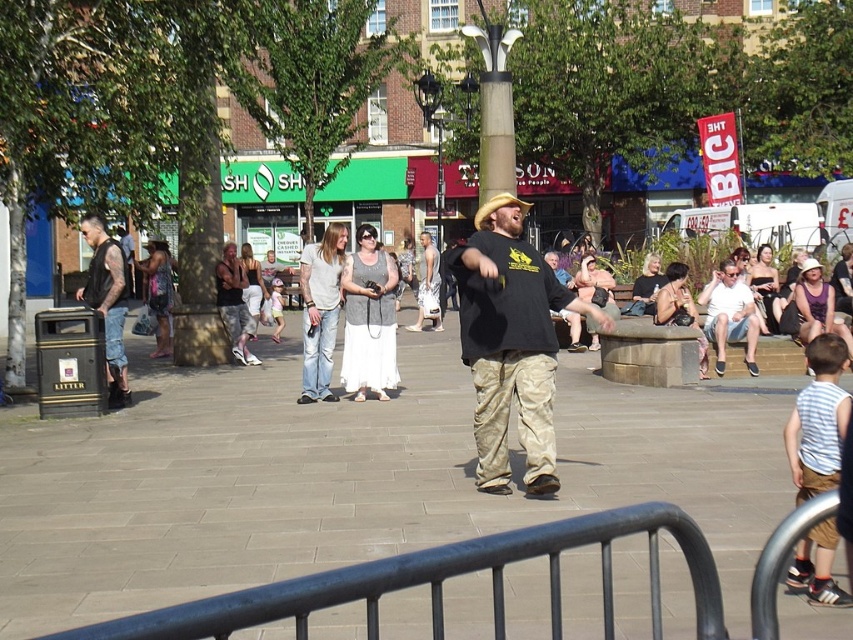
Can you confirm if metallic gray railing at center is positioned to the right of black matte t-shirt at center?

Incorrect, metallic gray railing at center is not on the right side of black matte t-shirt at center.

Identify the location of metallic gray railing at center. This screenshot has width=853, height=640. (444, 580).

Locate an element on the screen. metallic gray railing at center is located at coordinates (444, 580).

At what (x,y) coordinates should I click in order to perform the action: click on metallic gray railing at center. Please return your answer as a coordinate pair (x, y). The width and height of the screenshot is (853, 640). Looking at the image, I should click on (444, 580).

Can you confirm if metallic gray railing at center is shorter than black leather vest at left?

Yes.

Who is taller, metallic gray railing at center or black leather vest at left?

With more height is black leather vest at left.

Between point (804, 531) and point (100, 241), which one is positioned behind?

The point (100, 241) is behind.

In order to click on metallic gray railing at center in this screenshot , I will do `click(444, 580)`.

Who is shorter, black matte t-shirt at center or black leather vest at left?

With less height is black matte t-shirt at center.

Which is in front, point (540, 328) or point (93, 291)?

Point (540, 328) is in front.

Who is more distant from viewer, (503, 490) or (120, 321)?

Positioned behind is point (120, 321).

Find the location of a particular element. black matte t-shirt at center is located at coordinates [511, 342].